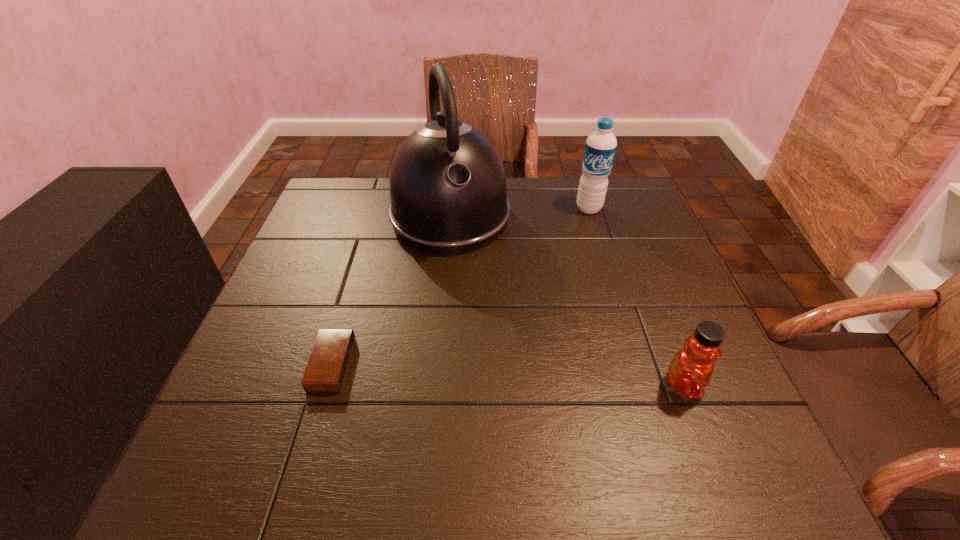
What are the coordinates of `honey present at the right edge` in the screenshot? It's located at (690, 371).

Identify the location of water bottle located in the right edge section of the desktop. [600, 148].

The width and height of the screenshot is (960, 540). Identify the location of object positioned at the near left corner. (328, 363).

The height and width of the screenshot is (540, 960). I want to click on object situated at the far right corner, so click(600, 148).

Identify the location of object located in the near right corner section of the desktop. This screenshot has width=960, height=540. (690, 371).

The width and height of the screenshot is (960, 540). I want to click on free space at the far edge of the desktop, so click(547, 205).

Image resolution: width=960 pixels, height=540 pixels. I want to click on vacant area at the near edge of the desktop, so click(348, 394).

You are a GUI agent. You are given a task and a screenshot of the screen. Output one action in this format:
    pyautogui.click(x=<x>, y=<y>)
    Task: Click on the vacant space at the left edge of the desktop
    Image resolution: width=960 pixels, height=540 pixels.
    Given the screenshot: What is the action you would take?
    pyautogui.click(x=348, y=231)

Where is `free space at the right edge of the desktop`? The height and width of the screenshot is (540, 960). free space at the right edge of the desktop is located at coordinates (662, 246).

This screenshot has width=960, height=540. Identify the location of vacant space at the far left corner of the desktop. (364, 200).